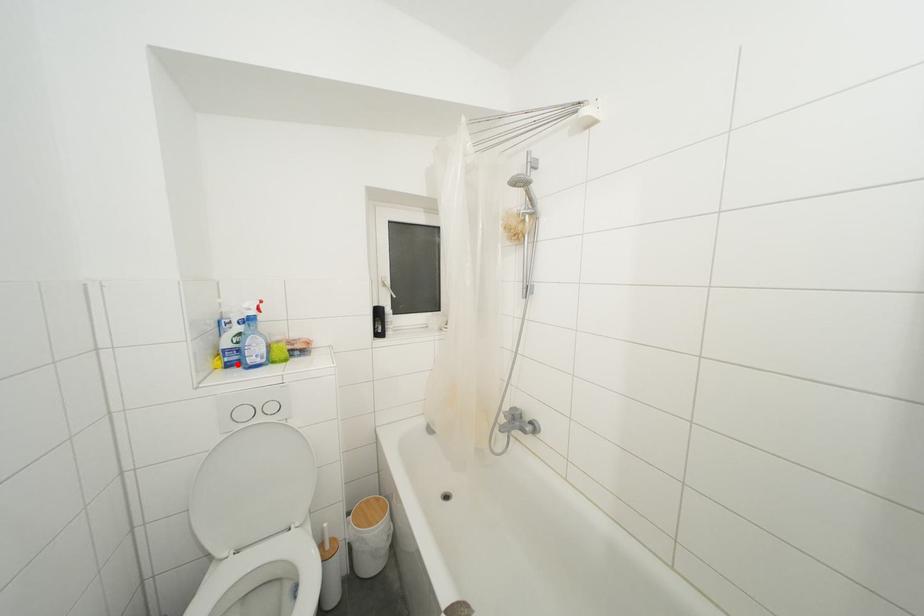
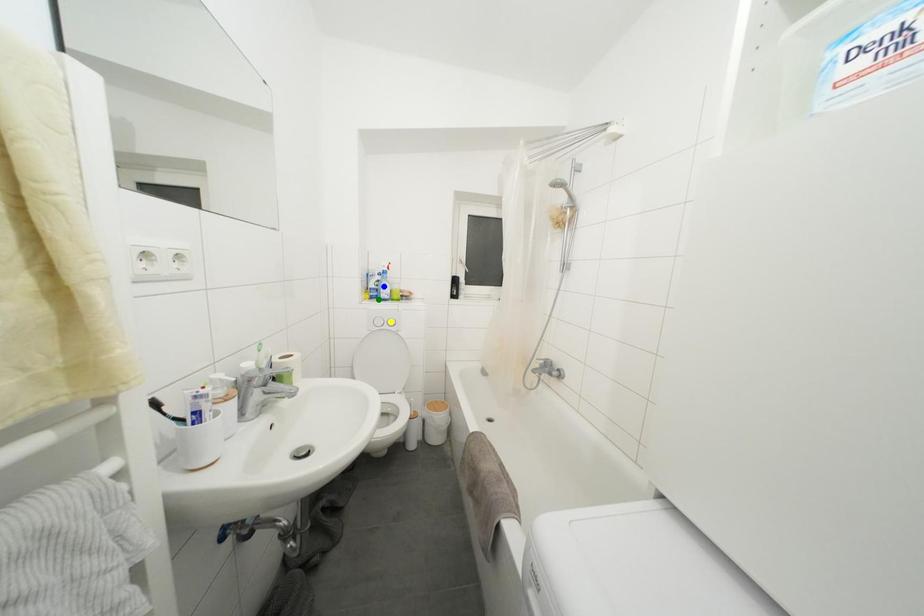
Question: I am providing you with two images of the same scene from different viewpoints. A red point is marked on the first image. You are given multiple points on the second image. Can you choose the point in image 2 that corresponds to the point in image 1?

Choices:
 (A) green point
 (B) yellow point
 (C) blue point

Answer: (A)